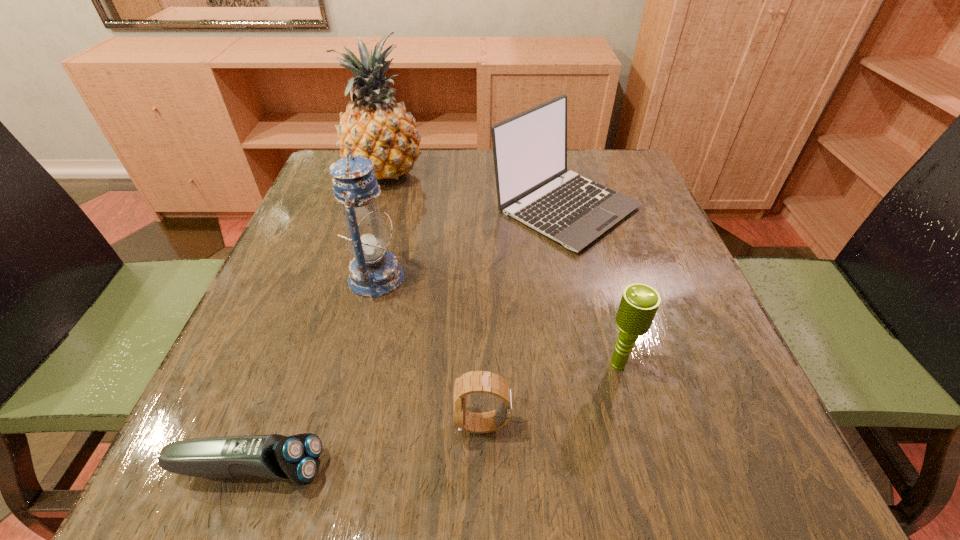
The height and width of the screenshot is (540, 960). In order to click on electric shaver located at the near edge in this screenshot , I will do tap(296, 458).

Image resolution: width=960 pixels, height=540 pixels. In order to click on pineapple located at the left edge in this screenshot , I will do `click(376, 127)`.

I want to click on lantern that is at the left edge, so click(x=373, y=272).

Identify the location of electric shaver situated at the left edge. The height and width of the screenshot is (540, 960). (296, 458).

Image resolution: width=960 pixels, height=540 pixels. I want to click on laptop_computer present at the right edge, so click(x=533, y=186).

This screenshot has height=540, width=960. I want to click on microphone that is at the right edge, so click(639, 303).

This screenshot has height=540, width=960. Identify the location of object present at the far left corner. (376, 127).

Where is `object at the near left corner`? The height and width of the screenshot is (540, 960). object at the near left corner is located at coordinates (296, 458).

Find the location of a particular element. The height and width of the screenshot is (540, 960). object positioned at the far right corner is located at coordinates (533, 186).

Where is `free region at the far edge of the desktop`? This screenshot has width=960, height=540. free region at the far edge of the desktop is located at coordinates (414, 179).